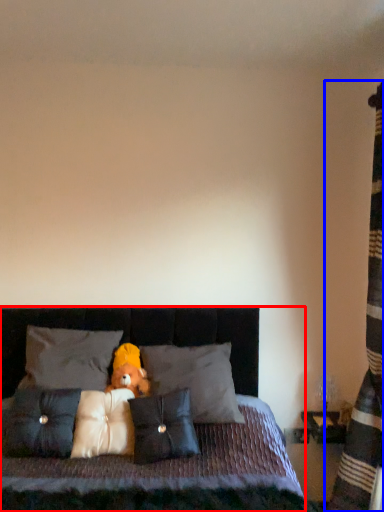
Question: Among these objects, which one is farthest to the camera, bed (highlighted by a red box) or curtain (highlighted by a blue box)?

Choices:
 (A) bed
 (B) curtain

Answer: (B)